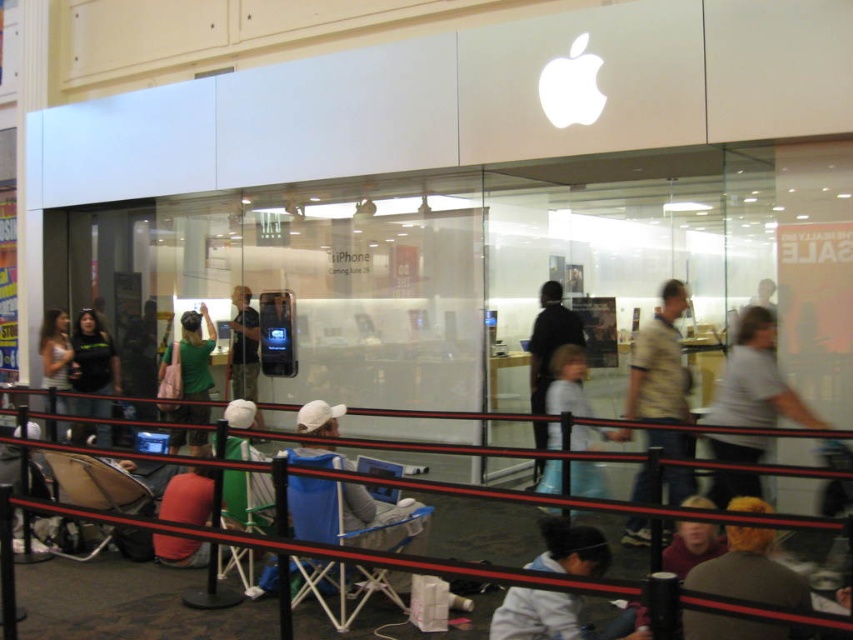
Which is in front, point (91, 467) or point (247, 486)?

Point (247, 486) is in front.

What do you see at coordinates (96, 483) in the screenshot?
I see `brown fabric chair at lower left` at bounding box center [96, 483].

The image size is (853, 640). Find the location of `brown fabric chair at lower left`. brown fabric chair at lower left is located at coordinates pyautogui.click(x=96, y=483).

Between brown fabric chair at lower left and black t-shirt at lower left, which one is positioned higher?

black t-shirt at lower left

Is brown fabric chair at lower left wider than black t-shirt at lower left?

Yes, brown fabric chair at lower left is wider than black t-shirt at lower left.

Between point (112, 538) and point (105, 412), which one is positioned behind?

The point (105, 412) is behind.

Where is `brown fabric chair at lower left`? brown fabric chair at lower left is located at coordinates (96, 483).

Can you confirm if metallic red barrier at lower center is positioned to the right of green matte shirt at center?

Yes, metallic red barrier at lower center is to the right of green matte shirt at center.

Which of these two, metallic red barrier at lower center or green matte shirt at center, stands shorter?

Standing shorter between the two is metallic red barrier at lower center.

Is point (225, 538) positioned after point (161, 376)?

No, it is in front of (161, 376).

Locate an element on the screen. The height and width of the screenshot is (640, 853). metallic red barrier at lower center is located at coordinates (343, 552).